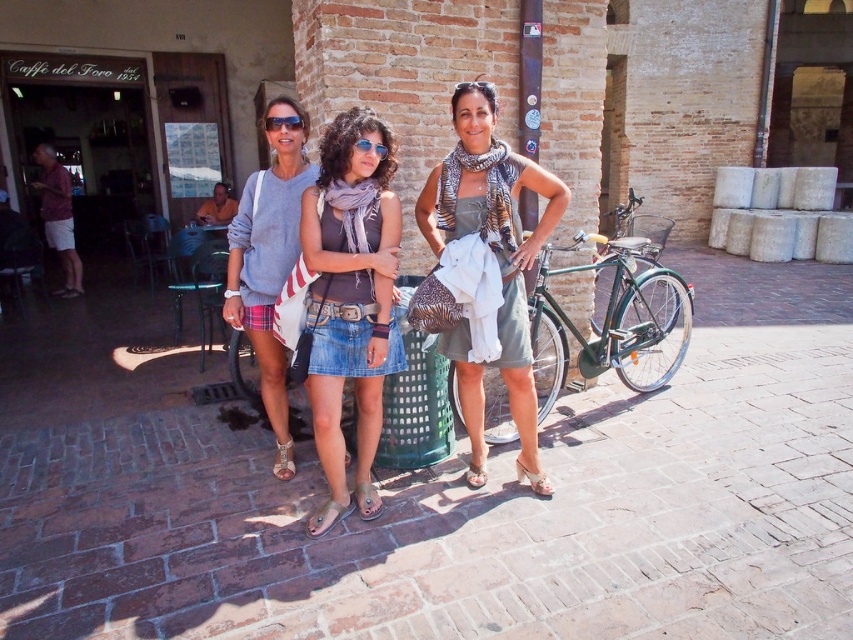
You are a photographer taking a picture of the matte gray sweater at center and the sunglasses at center. Which object is positioned lower in the image?

The matte gray sweater at center is below the sunglasses at center, so the sweater is positioned lower than the sunglasses in the image.

You are a tailor measuring garments for alterations. You have a customer who wants to know if their matte gray sweater at center will fit into their suitcase, which can only accommodate items narrower than their sunglasses at center. Based on the scene, can the sweater fit?

The matte gray sweater at center is wider than the sunglasses at center, so it will not fit into the suitcase designed for items narrower than the sunglasses at center.